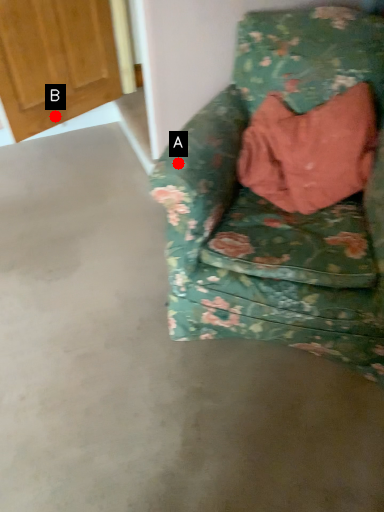
Question: Two points are circled on the image, labeled by A and B beside each circle. Which of the following is the farthest from the observer?

Choices:
 (A) A is further
 (B) B is further

Answer: (B)